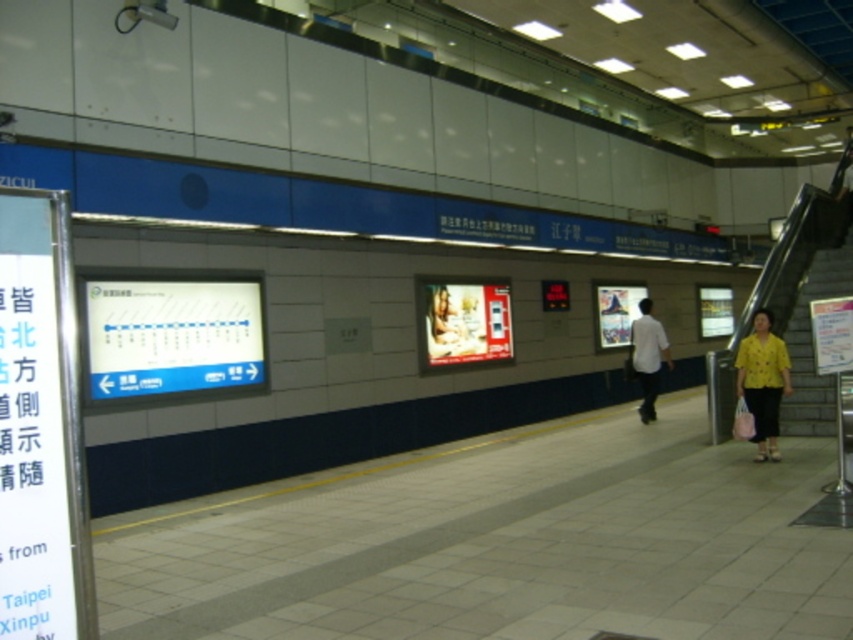
You are a commuter standing on the subway platform and see two shirts in the crowd. The yellow fabric shirt at right and the white matte shirt at center. Which shirt is larger?

The white matte shirt at center is larger than the yellow fabric shirt at right.